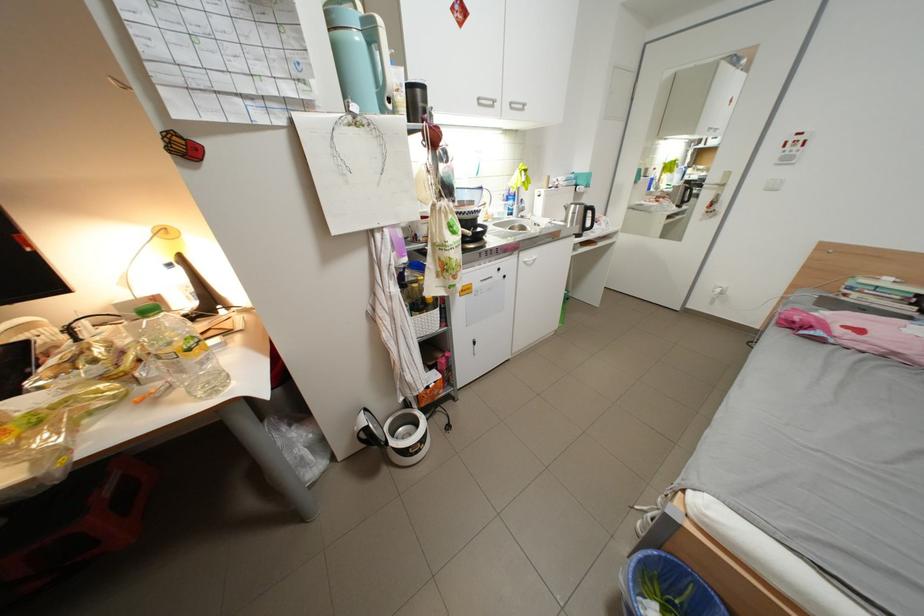
Locate an element on the screen. black kettle handle is located at coordinates (596, 222).